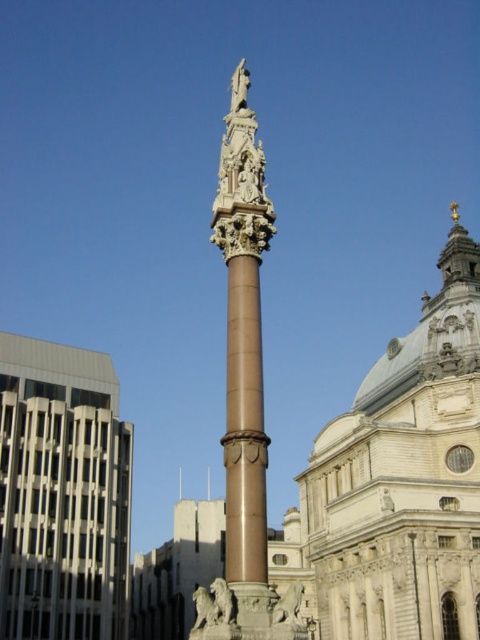
Question: Which object is the closest to the bronze/golden column at center?

Choices:
 (A) white glass building at left
 (B) light beige stone tower at center

Answer: (A)

Question: Which object is the closest to the white glass building at left?

Choices:
 (A) light beige stone tower at center
 (B) bronze/golden column at center

Answer: (B)

Question: Is light beige stone tower at center to the right of bronze/golden column at center from the viewer's perspective?

Choices:
 (A) no
 (B) yes

Answer: (B)

Question: Is light beige stone tower at center below white glass building at left?

Choices:
 (A) yes
 (B) no

Answer: (B)

Question: Does light beige stone tower at center appear under white glass building at left?

Choices:
 (A) yes
 (B) no

Answer: (B)

Question: Which point is farther from the camera taking this photo?

Choices:
 (A) (59, 609)
 (B) (232, 154)

Answer: (A)